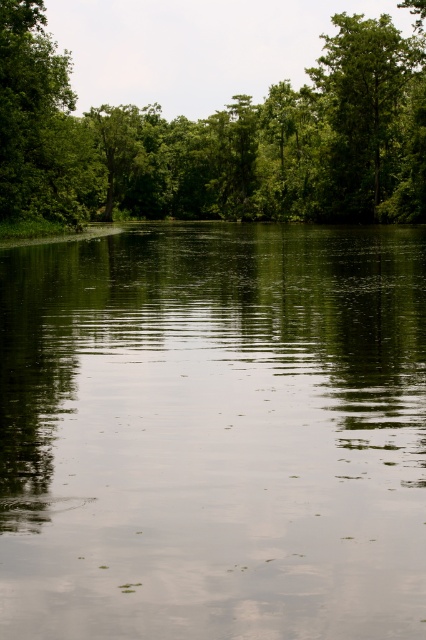
Question: Considering the real-world distances, which object is closest to the green leafy forest at center?

Choices:
 (A) green leafy tree at upper right
 (B) green reflective water at center

Answer: (A)

Question: Which point is closer to the camera?

Choices:
 (A) (63, 141)
 (B) (420, 84)
 (C) (379, 480)

Answer: (C)

Question: Can you confirm if green reflective water at center is smaller than green leafy forest at center?

Choices:
 (A) no
 (B) yes

Answer: (B)

Question: Among these points, which one is nearest to the camera?

Choices:
 (A) (353, 60)
 (B) (176, 124)
 (C) (371, 419)

Answer: (C)

Question: Can you confirm if green leafy forest at center is thinner than green leafy tree at upper right?

Choices:
 (A) no
 (B) yes

Answer: (A)

Question: Can you confirm if green leafy forest at center is smaller than green leafy tree at upper right?

Choices:
 (A) yes
 (B) no

Answer: (B)